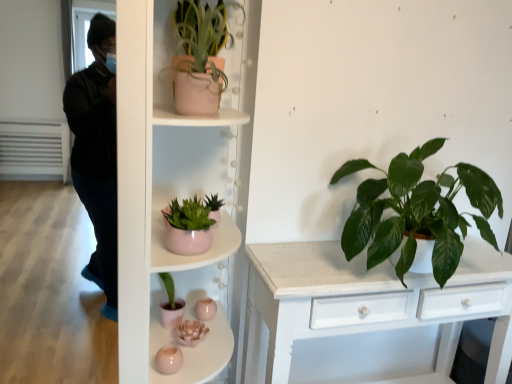
Question: Is matte pink pot at center, which ranks as the 1th shelf in bottom-to-top order, in front of or behind matte pink pot at upper center, the 1th houseplant viewed from the top, in the image?

Choices:
 (A) behind
 (B) front

Answer: (B)

Question: Is point (144, 354) positioned closer to the camera than point (211, 11)?

Choices:
 (A) farther
 (B) closer

Answer: (A)

Question: Which object is positioned farthest from the matte pink pot at center, the 2th shelf ordered from the bottom?

Choices:
 (A) green glossy leafy plant at right, which is counted as the 2th houseplant, starting from the left
 (B) matte pink pot at center, which ranks as the 1th shelf in bottom-to-top order
 (C) matte pink pot at upper center, the 1th houseplant viewed from the top

Answer: (A)

Question: Estimate the real-world distances between objects in this image. Which object is closer to the green glossy leafy plant at right, which is counted as the 2th houseplant, starting from the left?

Choices:
 (A) matte pink pot at upper center, which appears as the 1th houseplant when viewed from the left
 (B) matte pink pot at center, which ranks as the 1th shelf in bottom-to-top order
 (C) matte pink pot at center, which ranks as the first shelf in top-to-bottom order

Answer: (C)